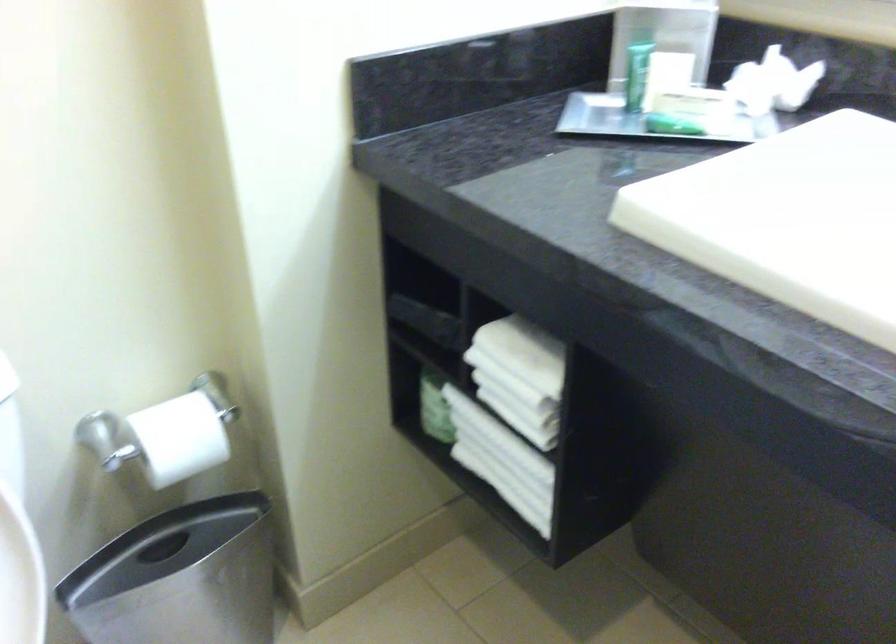
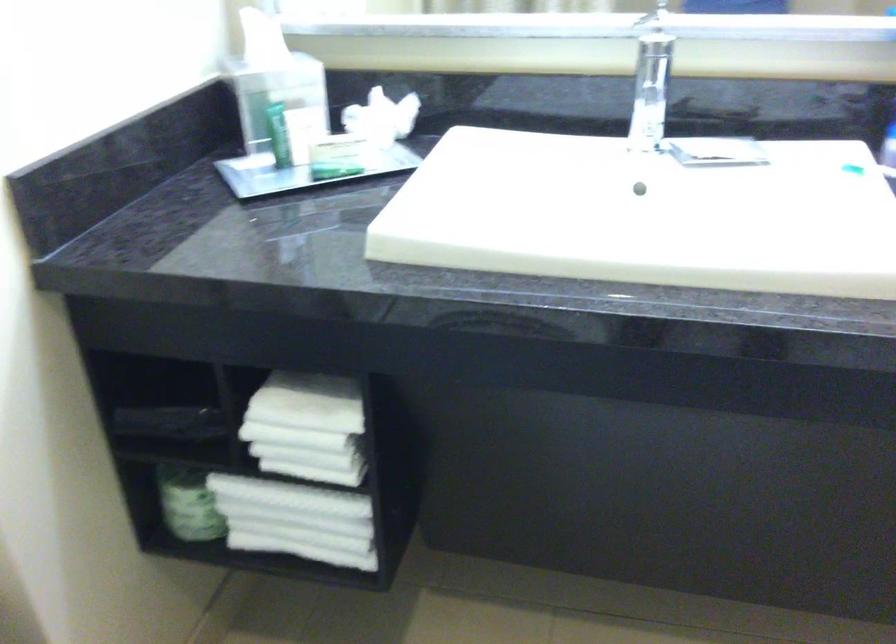
In the second image, find the point that corresponds to point (431, 402) in the first image.

(188, 504)